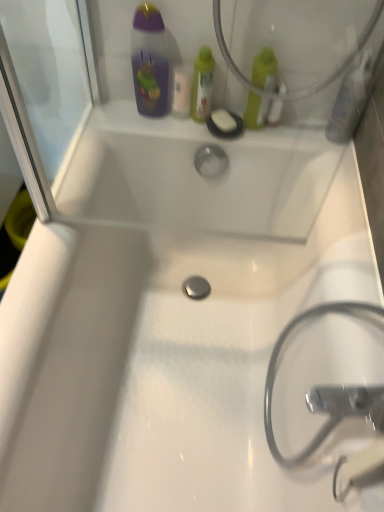
This screenshot has width=384, height=512. I want to click on free location in front of translucent plastic mouthwash at upper right, arranged as the first mouthwash when viewed from the right, so click(x=342, y=173).